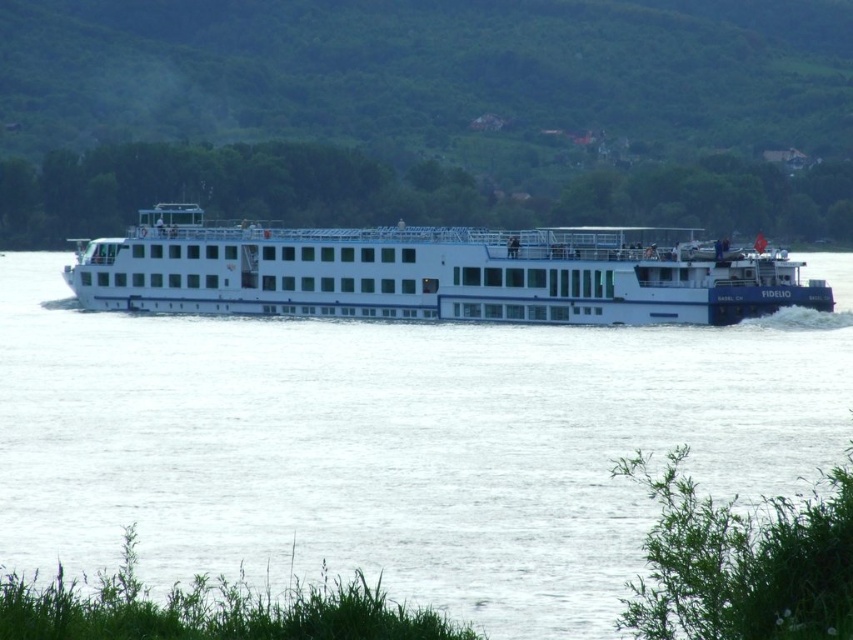
You are a passenger on the Fidelio cruise ship and want to take a photo of the white glossy cruise ship at center from the deck. However, you notice the white smooth water at center might obstruct your view. Is the water below or above the ship?

The white smooth water at center is below the white glossy cruise ship at center, so the water is below the ship and won

You are standing on the grassy area near the water and looking at the scene. Which object is closer to you between the white smooth water at center and the white glossy cruise ship at center?

The white smooth water at center is closer to you because it is in front of the white glossy cruise ship at center.

You are standing on the deck of the Fidelio cruise ship and want to take a photo of the point at coordinates (187,456). If your camera has a maximum focus range of 35 meters, will it be able to focus on that point?

The point at coordinates (187,456) is 34.78 meters from the camera, which is within the maximum focus range of 35 meters. Therefore, the camera can focus on that point.